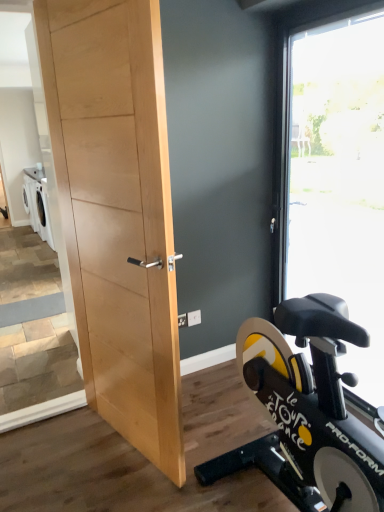
Question: Considering the positions of natural wood door at center and transparent glass window at right in the image, is natural wood door at center bigger or smaller than transparent glass window at right?

Choices:
 (A) big
 (B) small

Answer: (B)

Question: Considering the relative positions of natural wood door at center and transparent glass window at right in the image provided, is natural wood door at center to the left or to the right of transparent glass window at right?

Choices:
 (A) left
 (B) right

Answer: (A)

Question: From the image's perspective, is natural wood door at center located above or below transparent glass window at right?

Choices:
 (A) below
 (B) above

Answer: (A)

Question: Is transparent glass window at right inside or outside of natural wood door at center?

Choices:
 (A) inside
 (B) outside

Answer: (B)

Question: From the image's perspective, is transparent glass window at right above or below natural wood door at center?

Choices:
 (A) below
 (B) above

Answer: (B)

Question: Considering the positions of transparent glass window at right and natural wood door at center in the image, is transparent glass window at right wider or thinner than natural wood door at center?

Choices:
 (A) thin
 (B) wide

Answer: (B)

Question: Considering the relative positions of transparent glass window at right and natural wood door at center in the image provided, is transparent glass window at right to the left or to the right of natural wood door at center?

Choices:
 (A) right
 (B) left

Answer: (A)